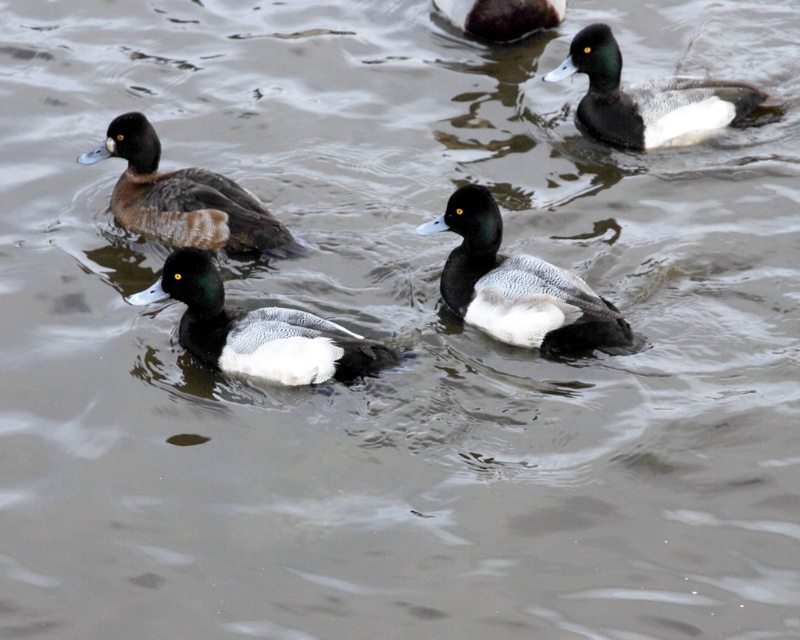
This screenshot has height=640, width=800. What do you see at coordinates (520, 285) in the screenshot?
I see `black matte duck at center` at bounding box center [520, 285].

Between black matte duck at center and matte black duck at center, which one appears on the right side from the viewer's perspective?

black matte duck at center

At what (x,y) coordinates should I click in order to perform the action: click on black matte duck at center. Please return your answer as a coordinate pair (x, y). Looking at the image, I should click on pyautogui.click(x=520, y=285).

Locate an element on the screen. This screenshot has height=640, width=800. black matte duck at center is located at coordinates (520, 285).

What do you see at coordinates (520, 285) in the screenshot? I see `black matte duck at center` at bounding box center [520, 285].

Can you confirm if black matte duck at center is smaller than matte black duck at left?

No.

I want to click on black matte duck at center, so click(x=520, y=285).

Who is higher up, black matte duck at center or matte black duck at upper right?

matte black duck at upper right is above.

Who is taller, black matte duck at center or matte black duck at upper right?

Standing taller between the two is black matte duck at center.

Measure the distance between black matte duck at center and camera.

black matte duck at center is 4.46 meters from camera.

This screenshot has height=640, width=800. I want to click on black matte duck at center, so click(520, 285).